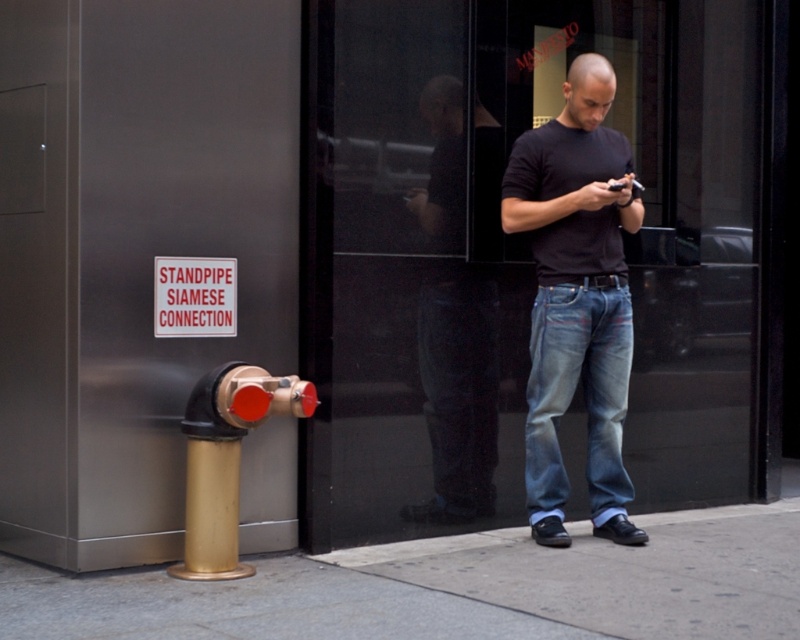
Question: Which object is positioned closest to the smooth concrete pavement at lower center?

Choices:
 (A) denim jeans at center
 (B) dark blue jeans at center
 (C) matte black shirt at center

Answer: (A)

Question: Is the position of smooth concrete pavement at lower center less distant than that of gold metallic hydrant at lower left?

Choices:
 (A) yes
 (B) no

Answer: (A)

Question: Is denim jeans at center positioned in front of gold metallic hydrant at lower left?

Choices:
 (A) yes
 (B) no

Answer: (B)

Question: Does smooth concrete pavement at lower center lie in front of dark blue jeans at center?

Choices:
 (A) no
 (B) yes

Answer: (B)

Question: Which is nearer to the dark blue jeans at center?

Choices:
 (A) gold metallic hydrant at lower left
 (B) denim jeans at center
 (C) matte black shirt at center

Answer: (C)

Question: Which of these objects is positioned farthest from the denim jeans at center?

Choices:
 (A) gold metallic hydrant at lower left
 (B) smooth concrete pavement at lower center
 (C) matte black shirt at center

Answer: (A)